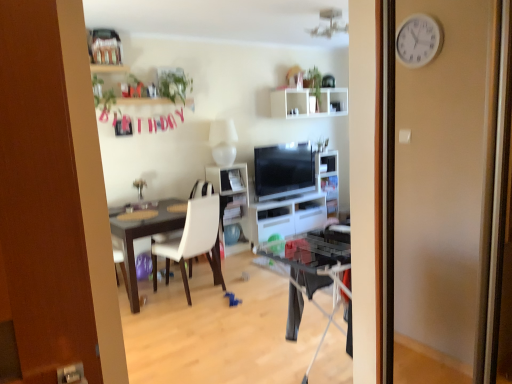
Question: Considering the positions of white matte shelf at upper center, placed as the 1th shelf when sorted from top to bottom, and white glossy cabinet at center in the image, is white matte shelf at upper center, placed as the 1th shelf when sorted from top to bottom, bigger or smaller than white glossy cabinet at center?

Choices:
 (A) small
 (B) big

Answer: (A)

Question: Does point (278, 110) appear closer or farther from the camera than point (257, 243)?

Choices:
 (A) farther
 (B) closer

Answer: (A)

Question: Which object is positioned closest to the matte black tv at center?

Choices:
 (A) white matte chair at center
 (B) white matte shelf at upper center, the second shelf viewed from the front
 (C) white glossy shelf at center, the 2th shelf viewed from the top
 (D) white glossy cabinet at center
 (E) green leafy plant at upper center

Answer: (D)

Question: Considering the real-world distances, which object is farthest from the green leafy plant at upper center?

Choices:
 (A) white matte chair at center
 (B) white glossy shelf at center, acting as the 1th shelf starting from the bottom
 (C) white glossy cabinet at center
 (D) white matte shelf at upper center, the first shelf viewed from the right
 (E) matte black tv at center

Answer: (D)